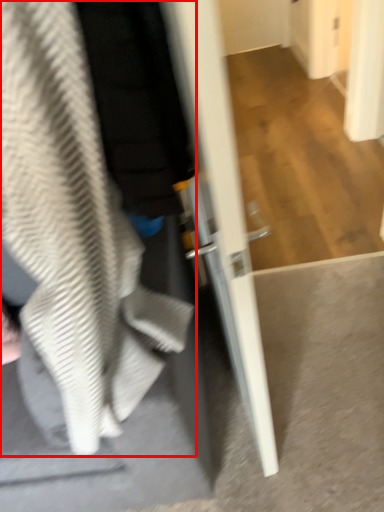
Question: From the image, what is the correct spatial relationship of sweatshirt (annotated by the red box) in relation to door?

Choices:
 (A) left
 (B) right

Answer: (A)